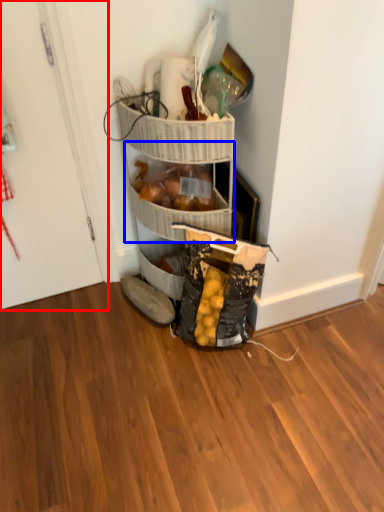
Question: Among these objects, which one is nearest to the camera, door (highlighted by a red box) or basket (highlighted by a blue box)?

Choices:
 (A) door
 (B) basket

Answer: (A)